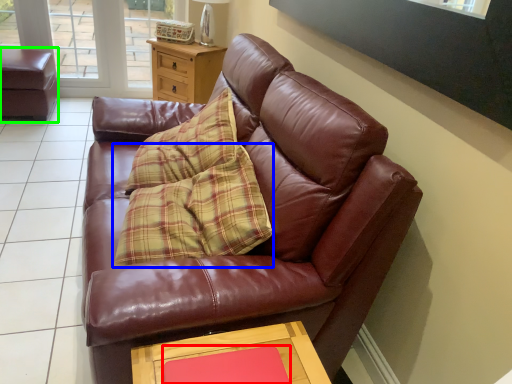
Question: Considering the real-world distances, which object is farthest from flat (highlighted by a red box)? pillow (highlighted by a blue box) or swivel chair (highlighted by a green box)?

Choices:
 (A) pillow
 (B) swivel chair

Answer: (B)